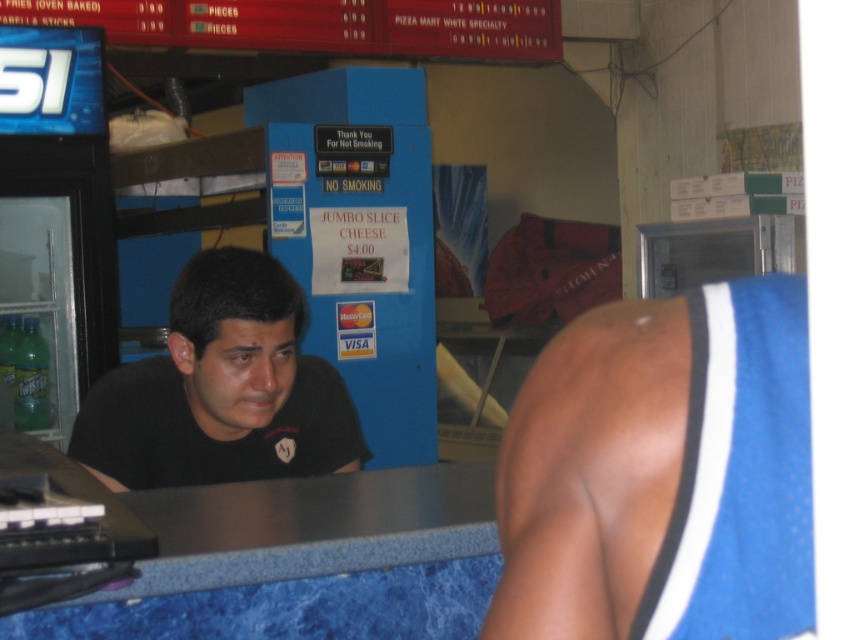
Which is in front, point (660, 314) or point (198, 502)?

Point (660, 314) is in front.

Find the location of a particular element. blue jersey at center is located at coordinates (663, 474).

At what (x,y) coordinates should I click in order to perform the action: click on blue jersey at center. Please return your answer as a coordinate pair (x, y). Looking at the image, I should click on (663, 474).

Find the location of `blue jersey at center`. blue jersey at center is located at coordinates (663, 474).

Who is shorter, blue jersey at center or black matte shirt at center?

Standing shorter between the two is blue jersey at center.

Who is higher up, blue jersey at center or black matte shirt at center?

blue jersey at center

I want to click on blue jersey at center, so click(x=663, y=474).

Can you confirm if blue laminate counter at center is taller than black matte shirt at center?

No.

Between point (138, 564) and point (161, 433), which one is positioned behind?

The point (161, 433) is more distant.

Image resolution: width=853 pixels, height=640 pixels. Identify the location of blue laminate counter at center. (302, 561).